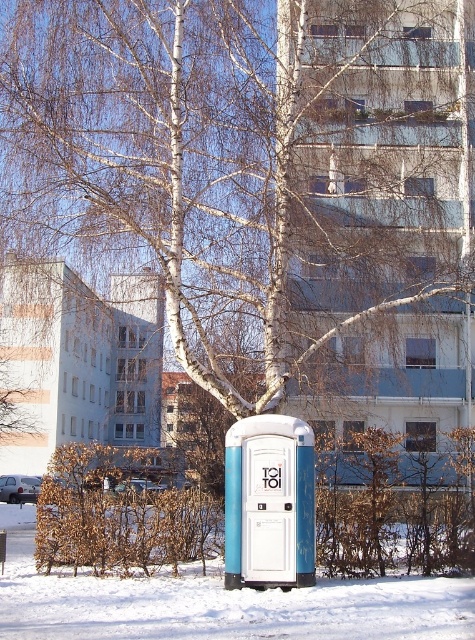
Question: Is brown leafy shrub at lower left bigger than blue plastic toilet at center?

Choices:
 (A) no
 (B) yes

Answer: (B)

Question: Can you confirm if white powdery snow at lower center is positioned below brown leafy shrub at lower left?

Choices:
 (A) yes
 (B) no

Answer: (A)

Question: Can you confirm if brown leafy shrub at lower left is thinner than blue plastic toilet at center?

Choices:
 (A) no
 (B) yes

Answer: (A)

Question: Which of these objects is positioned closest to the white powdery snow at lower center?

Choices:
 (A) blue plastic toilet at center
 (B) brown leafy shrub at lower left

Answer: (A)

Question: Which object is positioned farthest from the blue plastic toilet at center?

Choices:
 (A) white powdery snow at lower center
 (B) brown leafy shrub at lower left

Answer: (B)

Question: Among these points, which one is nearest to the camera?

Choices:
 (A) (247, 500)
 (B) (142, 464)
 (C) (341, 632)

Answer: (C)